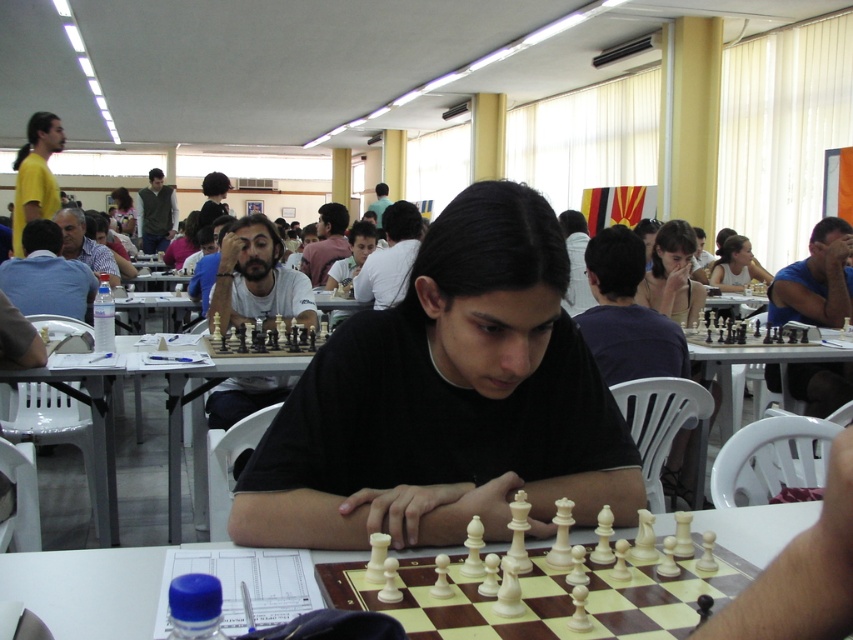
You are standing in the chess hall and want to place a small chess piece on the table. The piece must be placed either at point (99, 568) or point (343, 256). Which point is closer to you?

Point (99, 568) is closer to the viewer than point (343, 256), so you should place the chess piece there.

You are a photographer taking a picture of the chess scene. You want to ensure both the matte blue shirt at left and the dark brown hair at center are clearly visible in the frame. Given their sizes, which object should you focus on first to ensure depth of field captures both?

The matte blue shirt at left is smaller than the dark brown hair at center. To ensure both are in focus, you should focus on the dark brown hair at center first since it is larger and closer to the camera, allowing the smaller matte blue shirt at left to fall within the depth of field range.